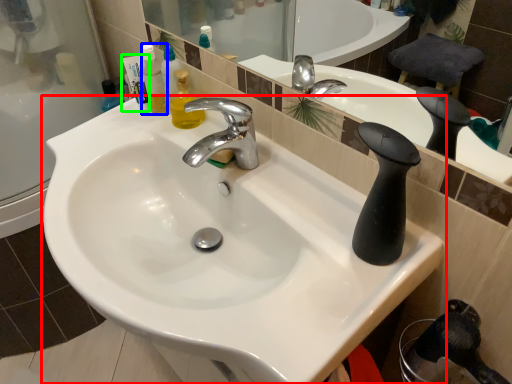
Question: Which is nearer to the sink (highlighted by a red box)? mouthwash (highlighted by a blue box) or toiletry (highlighted by a green box).

Choices:
 (A) mouthwash
 (B) toiletry

Answer: (A)